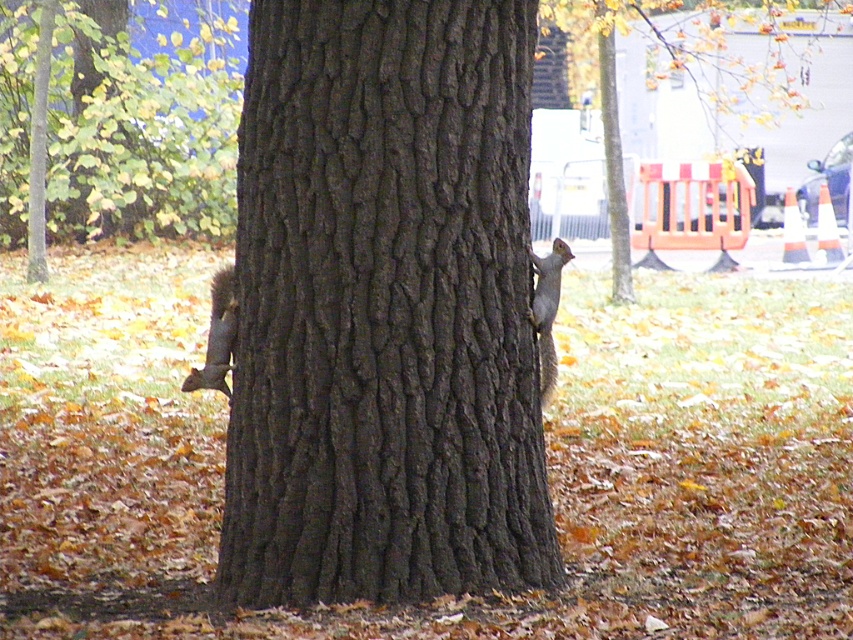
You are a small animal trying to cross from the brown rough bark at center to the gray furry squirrel at right. Given that your maximum jump distance is 24 inches, can you make the jump?

The distance between the brown rough bark at center and the gray furry squirrel at right is 24.53 inches, which is slightly longer than your maximum jump distance of 24 inches. Therefore, you cannot make the jump safely.

You are standing in the autumn forest and see two points marked in the scene. Which point is closer to you, point (440, 417) or point (567, 248)?

Point (440, 417) is in front of point (567, 248), so it is closer to you.

You are standing in the autumn forest and see the brown rough bark at center and the gray fur squirrel at left. Which object is positioned more to the east if the sun is setting in the west?

The gray fur squirrel at left is positioned more to the east because the brown rough bark at center is to the right of gray fur squirrel at left, and since the sun is setting in the west, the right side faces east.